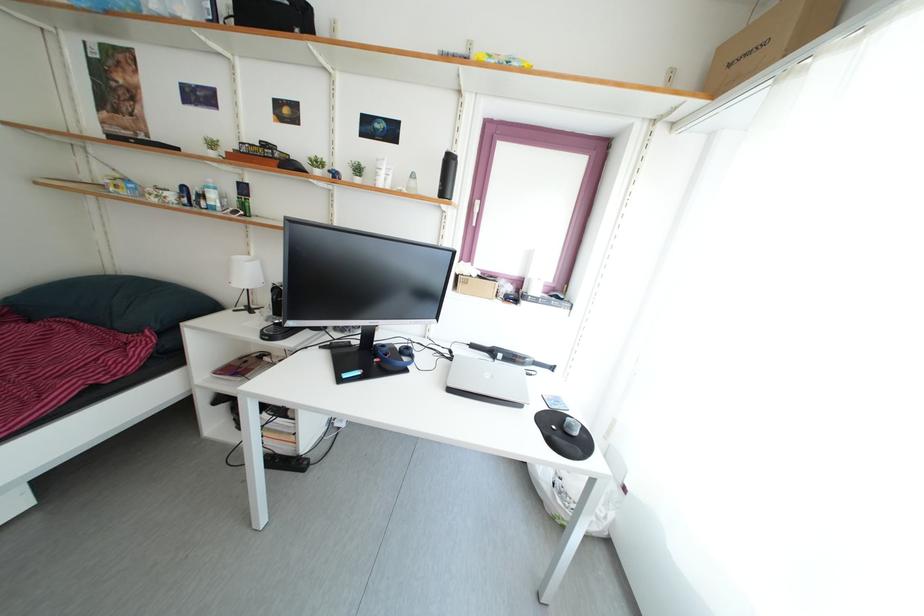
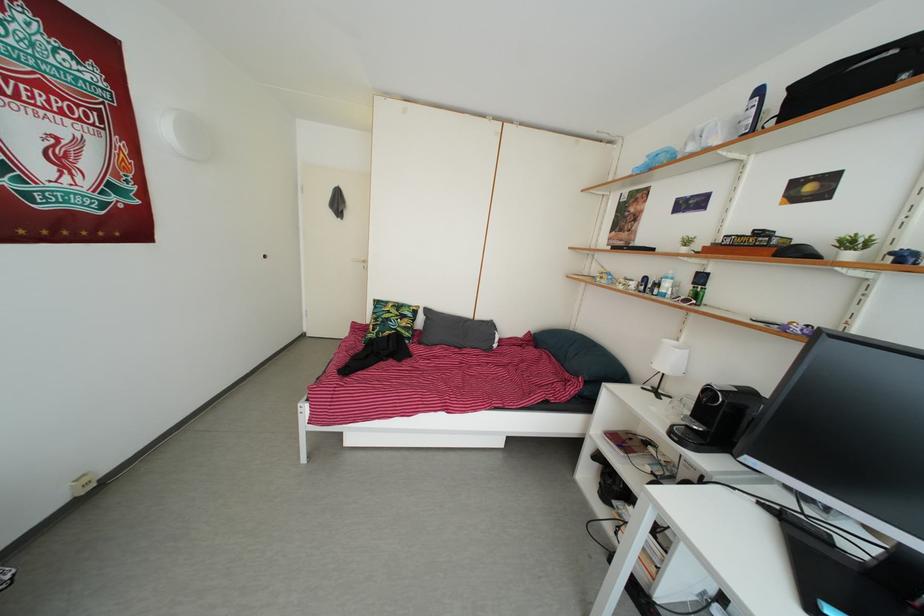
In the second image, find the point that corresponds to (252,265) in the first image.

(681, 351)